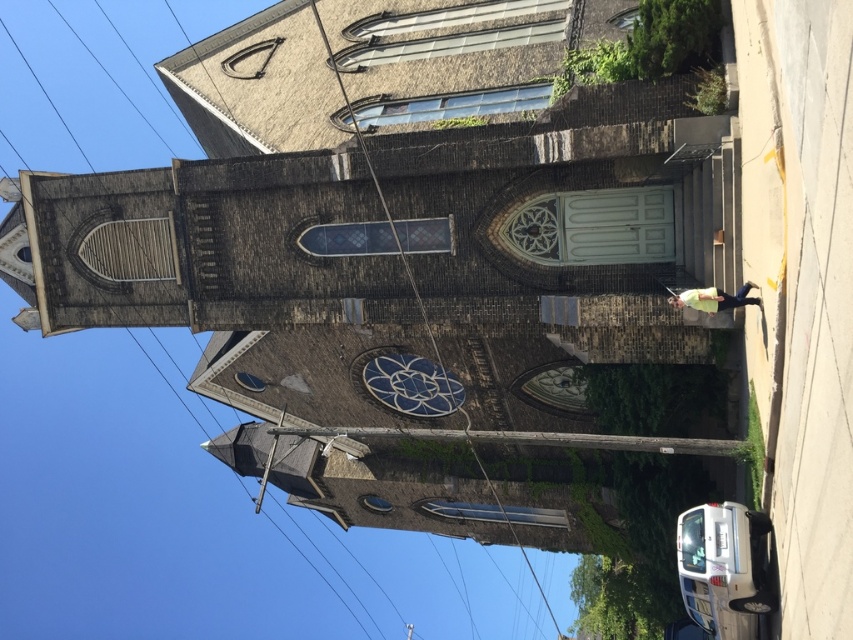
Can you confirm if blue stained glass clock at center is thinner than metallic wire at center?

Yes.

Is point (374, 372) closer to viewer compared to point (509, 536)?

Yes, point (374, 372) is closer to viewer.

What do you see at coordinates (408, 384) in the screenshot? I see `blue stained glass clock at center` at bounding box center [408, 384].

This screenshot has height=640, width=853. I want to click on blue stained glass clock at center, so 408,384.

Between point (512, 433) and point (393, 403), which one is positioned in front?

Point (512, 433)

Can you confirm if wooden pole at center is positioned below blue stained glass clock at center?

Correct, wooden pole at center is located below blue stained glass clock at center.

Is point (361, 435) less distant than point (407, 413)?

Yes.

Where is `wooden pole at center`? This screenshot has width=853, height=640. wooden pole at center is located at coordinates (531, 438).

Between wooden pole at center and metallic wire at center, which one appears on the left side from the viewer's perspective?

Positioned to the left is wooden pole at center.

Between wooden pole at center and metallic wire at center, which one has less height?

With less height is wooden pole at center.

Who is more forward, [572,436] or [509,534]?

Point [572,436] is in front.

This screenshot has height=640, width=853. I want to click on wooden pole at center, so click(x=531, y=438).